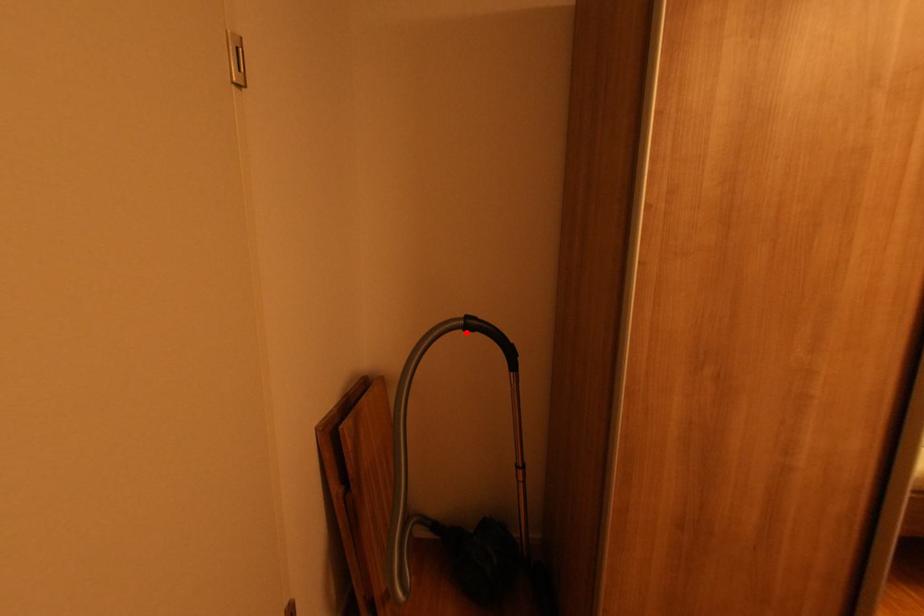
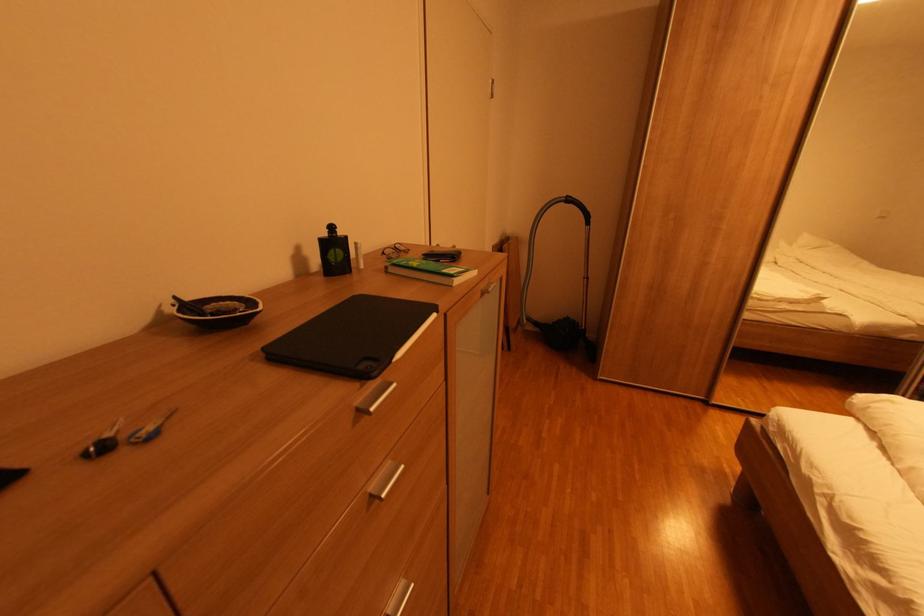
Question: I am providing you with two images of the same scene from different viewpoints. A red point is marked on the first image. Is the red point's position out of view in image 2?

Choices:
 (A) Yes
 (B) No

Answer: (B)